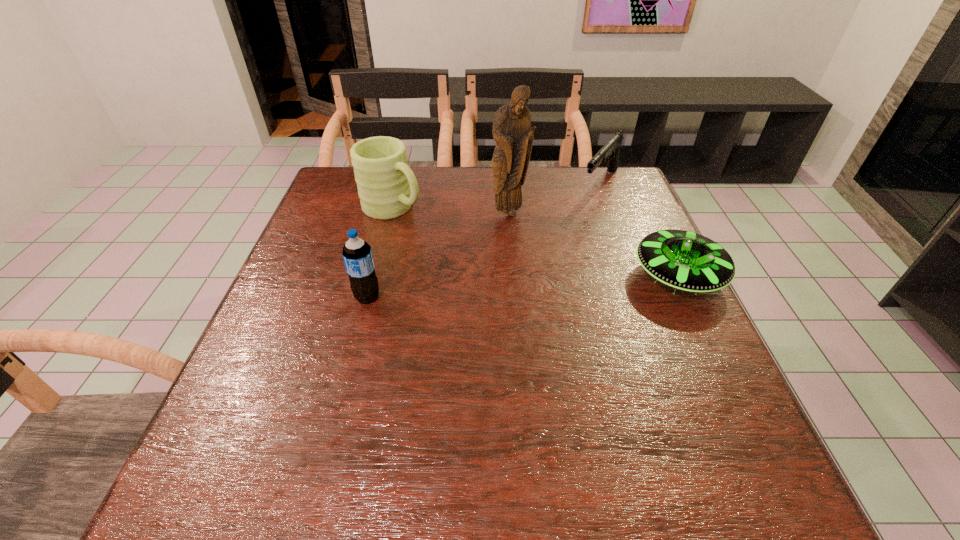
Image resolution: width=960 pixels, height=540 pixels. I want to click on vacant space at the far right corner of the desktop, so click(x=592, y=194).

Locate an element on the screen. This screenshot has height=540, width=960. empty space that is in between the gun and the figurine is located at coordinates (555, 198).

Locate an element on the screen. The width and height of the screenshot is (960, 540). vacant space in between the soda bottle and the gun is located at coordinates (484, 240).

This screenshot has height=540, width=960. I want to click on free space between the third object from right to left and the mug, so click(451, 211).

The width and height of the screenshot is (960, 540). In order to click on unoccupied position between the figurine and the shortest object in this screenshot , I will do `click(593, 245)`.

Where is `vacant region between the soda bottle and the mug`? vacant region between the soda bottle and the mug is located at coordinates (380, 253).

At what (x,y) coordinates should I click in order to perform the action: click on vacant area that lies between the gun and the soda bottle. Please return your answer as a coordinate pair (x, y). The image size is (960, 540). Looking at the image, I should click on (484, 240).

Locate an element on the screen. The height and width of the screenshot is (540, 960). vacant space in between the shortest object and the soda bottle is located at coordinates (523, 287).

Where is `vacant area that lies between the fourth tallest object and the saucer`? vacant area that lies between the fourth tallest object and the saucer is located at coordinates (639, 230).

Find the location of a particular element. The image size is (960, 540). vacant point located between the soda bottle and the second shortest object is located at coordinates (484, 240).